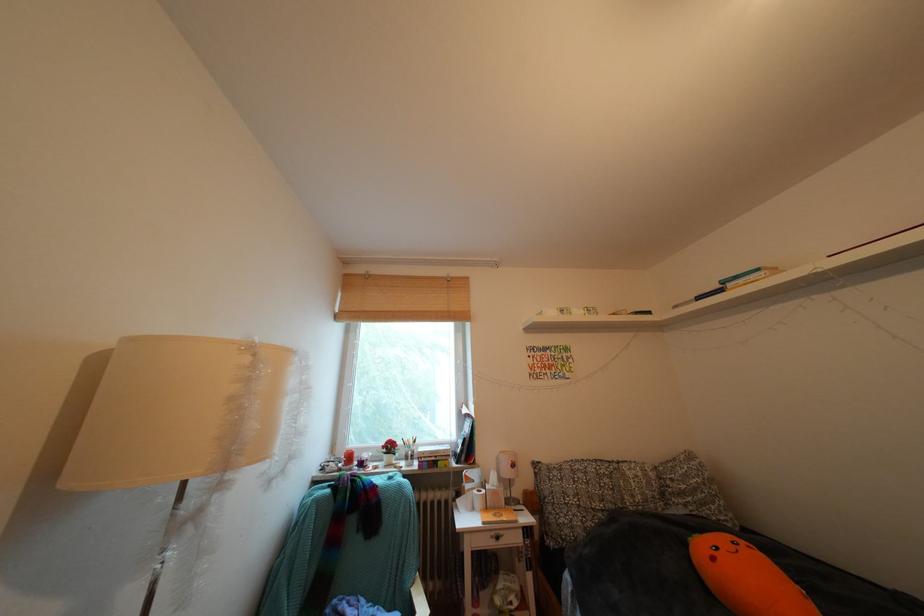
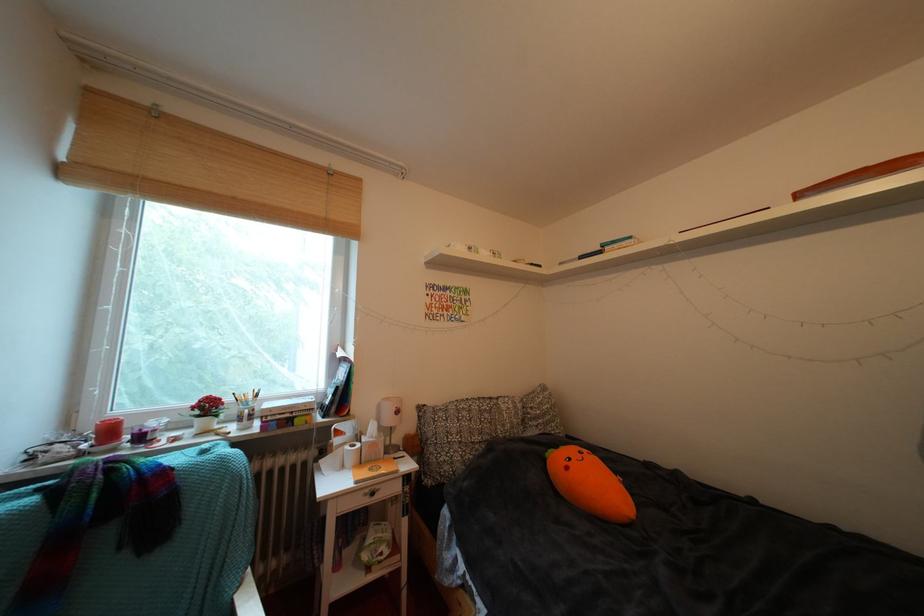
Question: How did the camera likely rotate?

Choices:
 (A) Left
 (B) Right
 (C) Up
 (D) Down

Answer: (B)